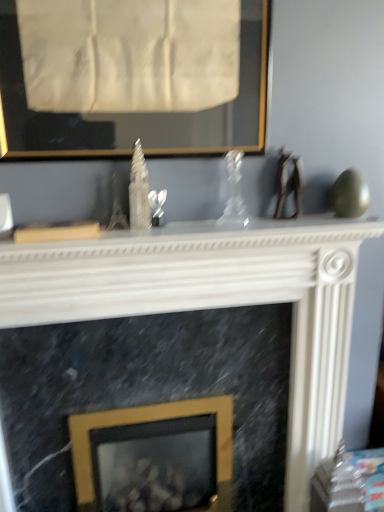
Question: Considering the positions of white marble fireplace at center and gold metallic picture frame at center, the second picture frame positioned from the top, in the image, is white marble fireplace at center bigger or smaller than gold metallic picture frame at center, the second picture frame positioned from the top,?

Choices:
 (A) small
 (B) big

Answer: (B)

Question: Considering the positions of white marble fireplace at center and gold metallic picture frame at center, the 1th picture frame ordered from the bottom, in the image, is white marble fireplace at center taller or shorter than gold metallic picture frame at center, the 1th picture frame ordered from the bottom,?

Choices:
 (A) short
 (B) tall

Answer: (B)

Question: Estimate the real-world distances between objects in this image. Which object is closer to the white marble fireplace at center?

Choices:
 (A) transparent glass vase at center
 (B) gold metallic picture frame at center, marked as the second picture frame in a front-to-back arrangement
 (C) gold-framed picture at upper center, the 1th picture frame when ordered from top to bottom

Answer: (A)

Question: Which object is positioned farthest from the gold-framed picture at upper center, the second picture frame from the bottom?

Choices:
 (A) transparent glass vase at center
 (B) white marble fireplace at center
 (C) gold metallic picture frame at center, marked as the second picture frame in a front-to-back arrangement

Answer: (C)